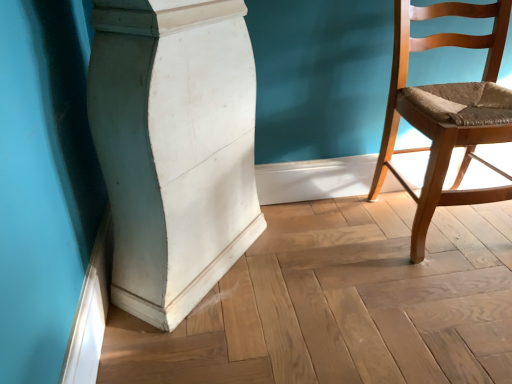
Question: Considering the positions of point (195, 81) and point (420, 251), is point (195, 81) closer or farther from the camera than point (420, 251)?

Choices:
 (A) closer
 (B) farther

Answer: (A)

Question: From the image's perspective, is white matte/wooden pillar at center located above or below light brown wooden chair at right?

Choices:
 (A) below
 (B) above

Answer: (A)

Question: From a real-world perspective, is white matte/wooden pillar at center physically located above or below light brown wooden chair at right?

Choices:
 (A) below
 (B) above

Answer: (B)

Question: In terms of size, does light brown wooden chair at right appear bigger or smaller than white matte/wooden pillar at center?

Choices:
 (A) small
 (B) big

Answer: (A)

Question: From their relative heights in the image, would you say light brown wooden chair at right is taller or shorter than white matte/wooden pillar at center?

Choices:
 (A) short
 (B) tall

Answer: (A)

Question: In terms of width, does light brown wooden chair at right look wider or thinner when compared to white matte/wooden pillar at center?

Choices:
 (A) thin
 (B) wide

Answer: (A)

Question: From a real-world perspective, is light brown wooden chair at right positioned above or below white matte/wooden pillar at center?

Choices:
 (A) above
 (B) below

Answer: (B)